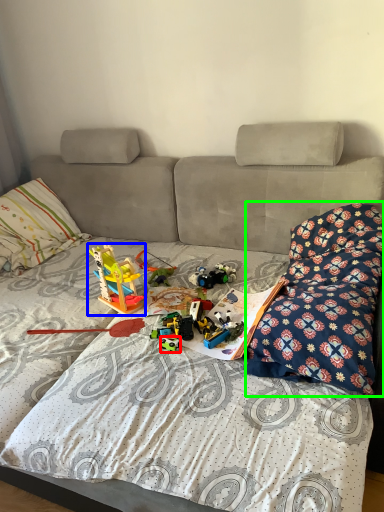
Question: Which object is the farthest from toy (highlighted by a red box)? Choose among these: toy (highlighted by a blue box) or blanket (highlighted by a green box).

Choices:
 (A) toy
 (B) blanket

Answer: (B)